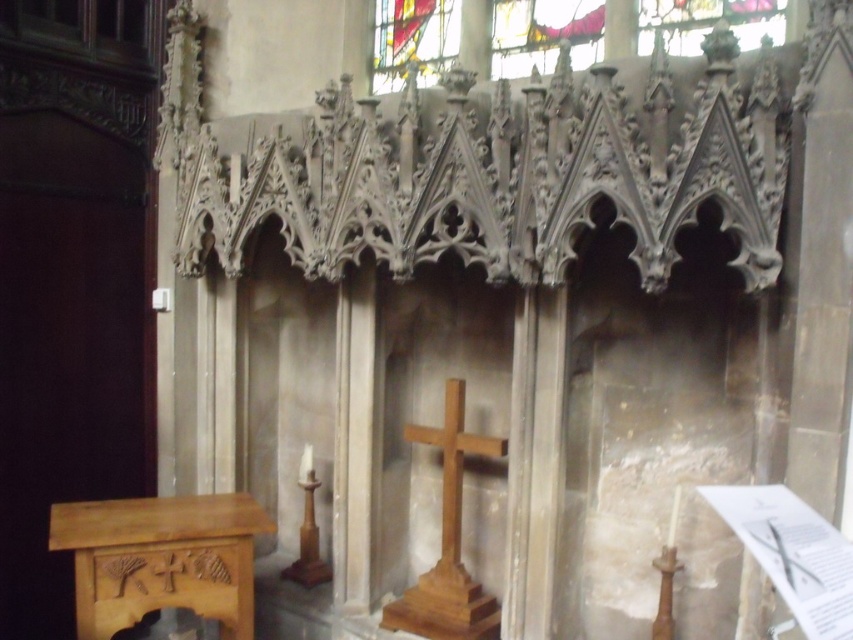
You are a tour guide explaining the layout of the cathedral to visitors. You mention the light brown polished wood altar at lower left and the wooden cross at center. How far apart are these two important features?

The distance between the light brown polished wood altar at lower left and the wooden cross at center is 31.68 inches.

You are standing at the entrance of the church and see the point marked at coordinates point (543, 33). What is located at that point?

The point (543, 33) is where the stained glass window at upper center is located.

You are standing in the cathedral and want to find the light brown polished wood altar at lower left. According to the coordinates, where should you look?

The light brown polished wood altar at lower left is located at coordinates point (161, 557).